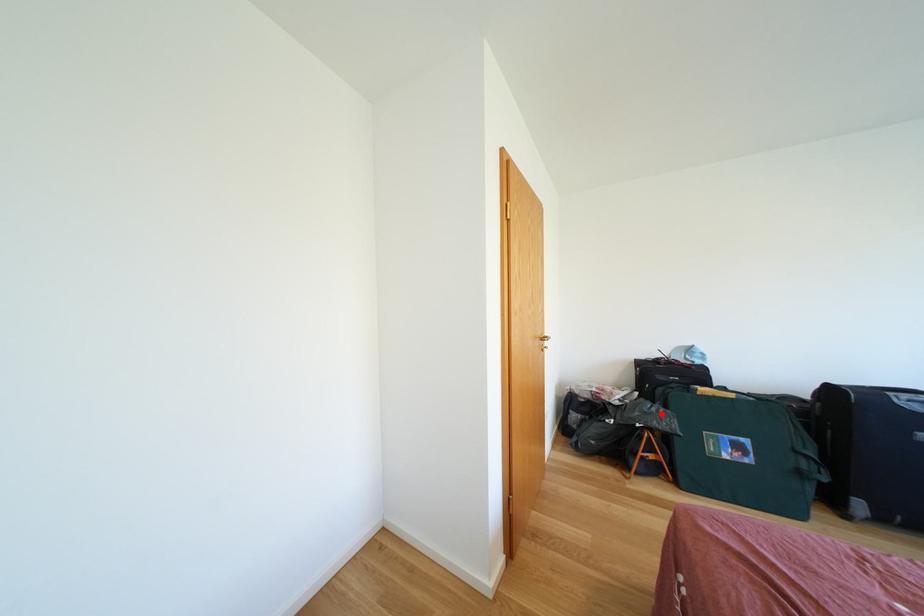
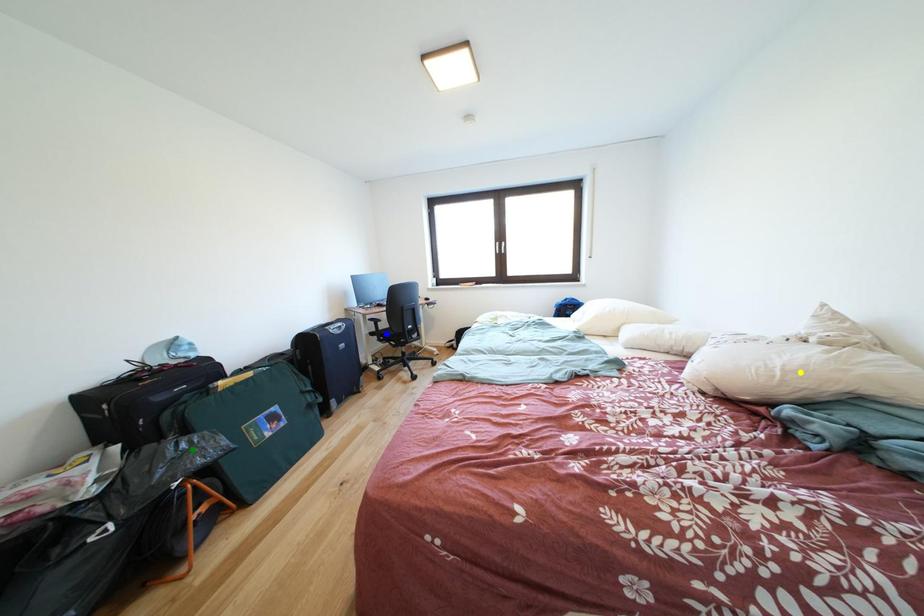
Question: I am providing you with two images of the same scene from different viewpoints. A red point is marked on the first image. You are given multiple points on the second image. In image 2, which mark is for the same physical point as the one in image 1?

Choices:
 (A) yellow point
 (B) blue point
 (C) green point

Answer: (C)